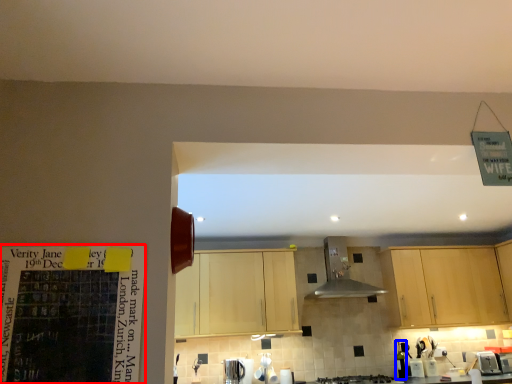
Question: Which of the following is the closest to the observer, bulletin board (highlighted by a red box) or bottle (highlighted by a blue box)?

Choices:
 (A) bulletin board
 (B) bottle

Answer: (A)